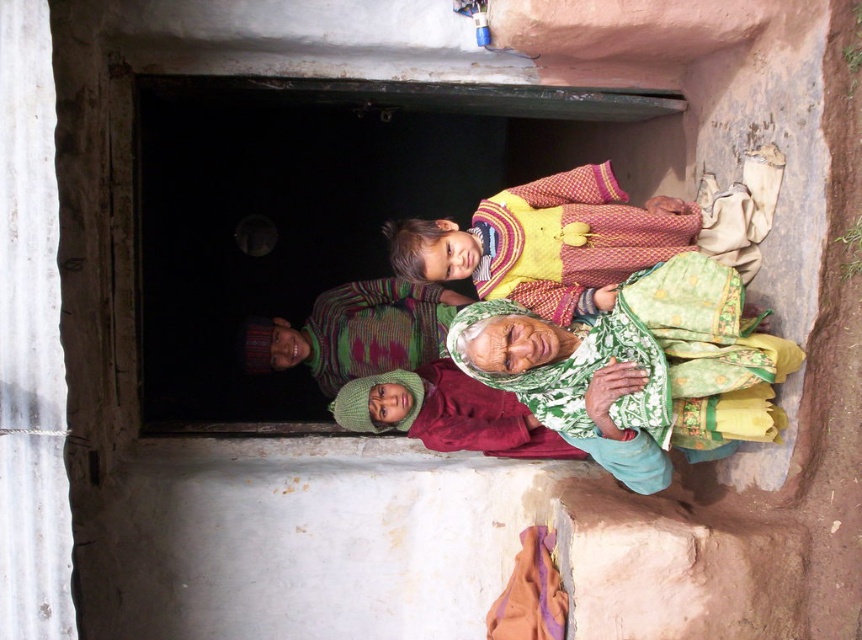
Question: Does transparent glass window at center appear under knitted green hat at center?

Choices:
 (A) no
 (B) yes

Answer: (A)

Question: Which object is the closest to the knitted sweater at center?

Choices:
 (A) knitted green hat at center
 (B) green knitted hat at lower center
 (C) transparent glass window at center

Answer: (A)

Question: Which of the following is the farthest from the observer?

Choices:
 (A) knitted green hat at center
 (B) transparent glass window at center

Answer: (A)

Question: Observing the image, what is the correct spatial positioning of green knitted hat at lower center in reference to knitted sweater at center?

Choices:
 (A) left
 (B) right

Answer: (B)

Question: Which point is farther to the camera?

Choices:
 (A) (214, 408)
 (B) (403, 301)
 (C) (453, 365)
 (D) (589, 410)

Answer: (A)

Question: Does knitted sweater at center lie in front of knitted green hat at center?

Choices:
 (A) yes
 (B) no

Answer: (B)